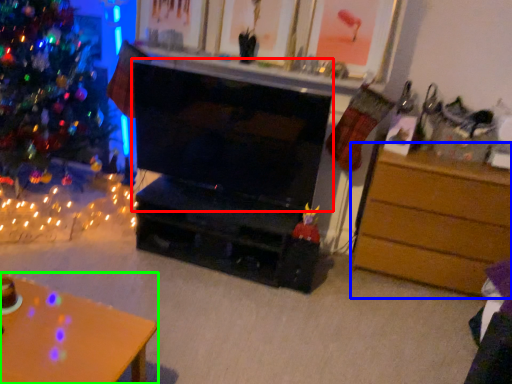
Question: Based on their relative distances, which object is farther from fireplace (highlighted by a red box)? Choose from chest of drawers (highlighted by a blue box) and desk (highlighted by a green box).

Choices:
 (A) chest of drawers
 (B) desk

Answer: (B)